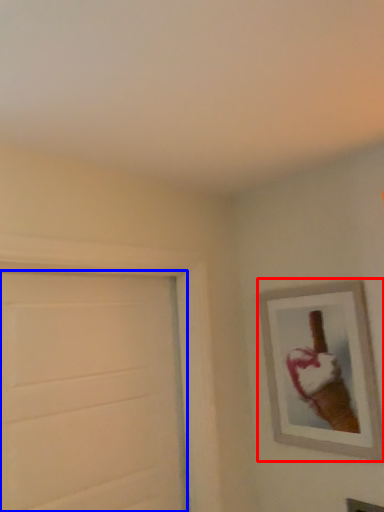
Question: Which object is closer to the camera taking this photo, picture frame (highlighted by a red box) or door (highlighted by a blue box)?

Choices:
 (A) picture frame
 (B) door

Answer: (B)